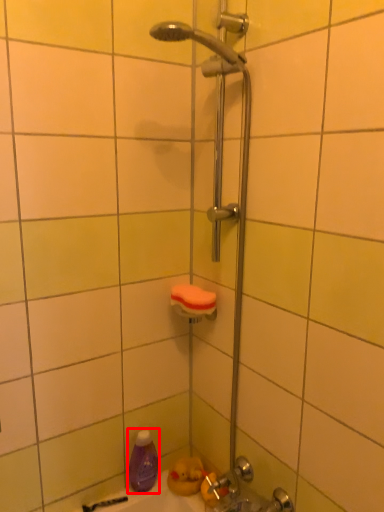
Question: Considering the relative positions of cleaning product (annotated by the red box) and towel bar in the image provided, where is cleaning product (annotated by the red box) located with respect to the staircase?

Choices:
 (A) right
 (B) left

Answer: (B)